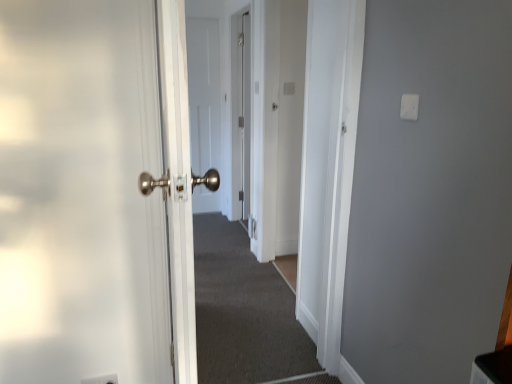
Question: Is white plastic electric outlet at lower left wider than carpeted corridor at center?

Choices:
 (A) yes
 (B) no

Answer: (B)

Question: Can you confirm if white plastic electric outlet at lower left is smaller than carpeted corridor at center?

Choices:
 (A) no
 (B) yes

Answer: (B)

Question: From a real-world perspective, is white plastic electric outlet at lower left over carpeted corridor at center?

Choices:
 (A) yes
 (B) no

Answer: (A)

Question: Can you confirm if white plastic electric outlet at lower left is bigger than carpeted corridor at center?

Choices:
 (A) no
 (B) yes

Answer: (A)

Question: From the image's perspective, would you say white plastic electric outlet at lower left is shown under carpeted corridor at center?

Choices:
 (A) yes
 (B) no

Answer: (A)

Question: From a real-world perspective, is white plastic electric outlet at lower left under carpeted corridor at center?

Choices:
 (A) no
 (B) yes

Answer: (A)

Question: From the image's perspective, is white matte door at center below carpeted corridor at center?

Choices:
 (A) no
 (B) yes

Answer: (A)

Question: Would you say carpeted corridor at center is part of white matte door at center's contents?

Choices:
 (A) yes
 (B) no

Answer: (B)

Question: Does white matte door at center appear on the right side of carpeted corridor at center?

Choices:
 (A) yes
 (B) no

Answer: (B)

Question: Is white matte door at center smaller than carpeted corridor at center?

Choices:
 (A) yes
 (B) no

Answer: (A)

Question: Is there a large distance between white matte door at center and carpeted corridor at center?

Choices:
 (A) yes
 (B) no

Answer: (A)

Question: Could you tell me if white matte door at center is turned towards carpeted corridor at center?

Choices:
 (A) no
 (B) yes

Answer: (B)

Question: Does carpeted corridor at center have a smaller size compared to white plastic light switch at upper right?

Choices:
 (A) yes
 (B) no

Answer: (B)